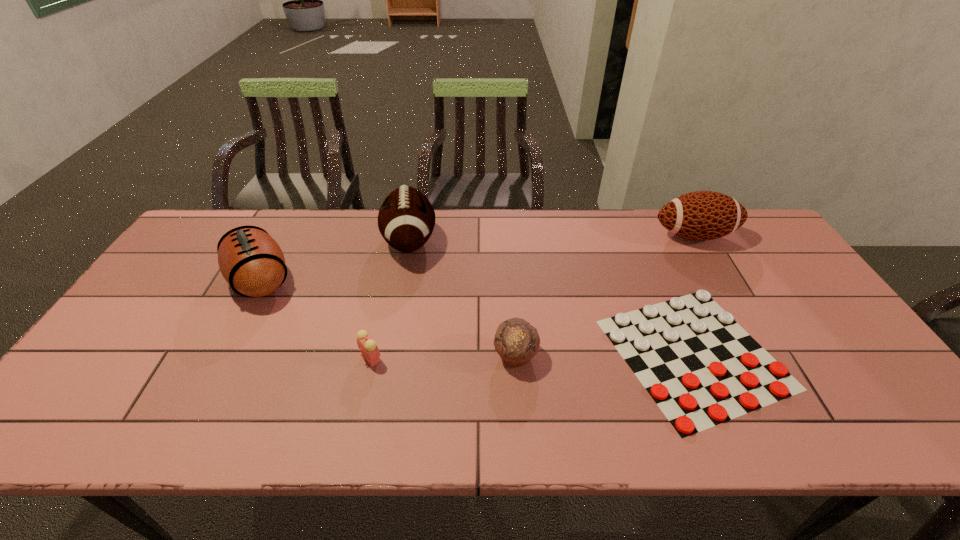
In order to click on free space located 0.370m on the right of the fourth tallest object in this screenshot , I will do `click(687, 355)`.

Locate an element on the screen. Image resolution: width=960 pixels, height=540 pixels. vacant space located 0.080m on the face of the alarm clock is located at coordinates (416, 358).

This screenshot has width=960, height=540. Find the location of `vacant space located on the left of the checkerboard`. vacant space located on the left of the checkerboard is located at coordinates (484, 353).

Locate an element on the screen. The width and height of the screenshot is (960, 540). object positioned at the near edge is located at coordinates (701, 368).

Where is `object present at the right edge`? This screenshot has width=960, height=540. object present at the right edge is located at coordinates (702, 215).

At what (x,y) coordinates should I click in order to perform the action: click on object at the far right corner. Please return your answer as a coordinate pair (x, y). The image size is (960, 540). Looking at the image, I should click on tap(702, 215).

In the image, there is a desktop. At what (x,y) coordinates should I click in order to perform the action: click on vacant space at the far edge. Please return your answer as a coordinate pair (x, y). The width and height of the screenshot is (960, 540). Looking at the image, I should click on (670, 237).

In the image, there is a desktop. Where is `free space at the left edge`? free space at the left edge is located at coordinates (162, 281).

Find the location of a particular element. free space at the right edge is located at coordinates (777, 293).

This screenshot has height=540, width=960. In the image, there is a desktop. Identify the location of free space at the far left corner. pyautogui.click(x=217, y=213).